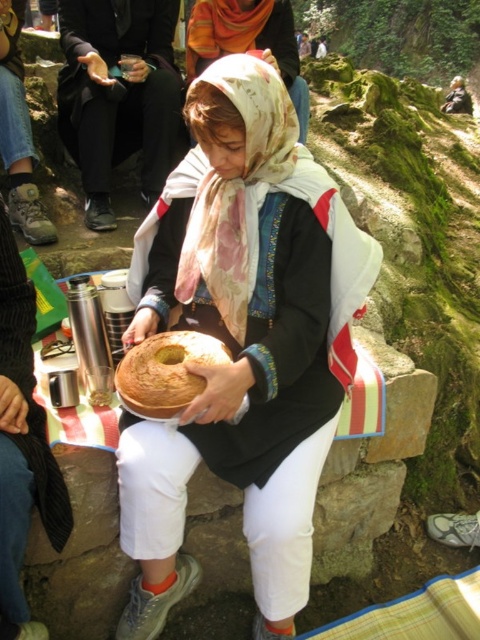
Based on the scene description, can you determine the spatial relationship between the white floral headscarf at center and the brown matte bread at center?

The white floral headscarf at center is above the brown matte bread at center.

You are planning to take a photo of the matte brown cake at center and the brown matte bread at center for a food blog. Since you want to highlight their height differences, which one should you position closer to the camera to emphasize its height?

To emphasize the height difference between the matte brown cake at center and the brown matte bread at center, position the matte brown cake at center closer to the camera since it is taller than the brown matte bread at center.